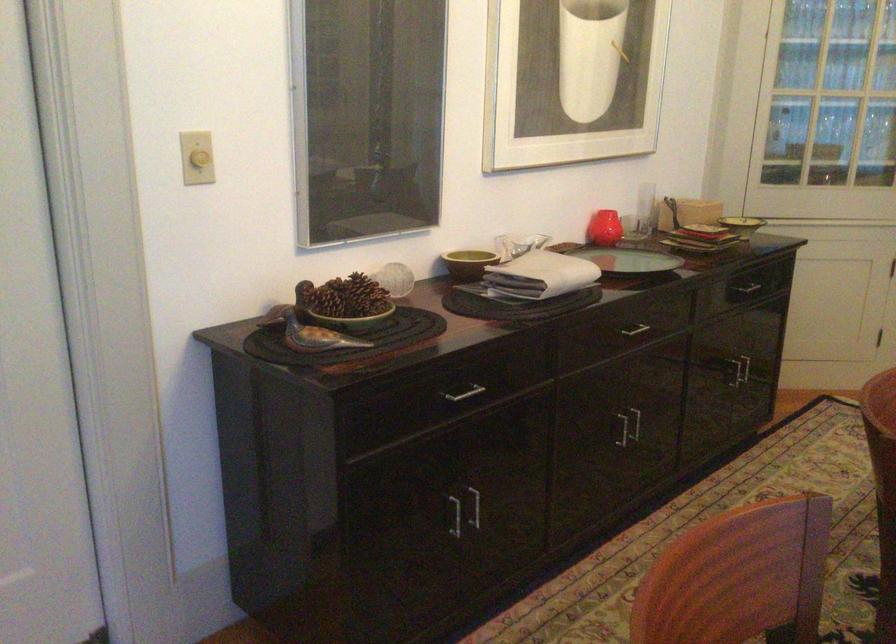
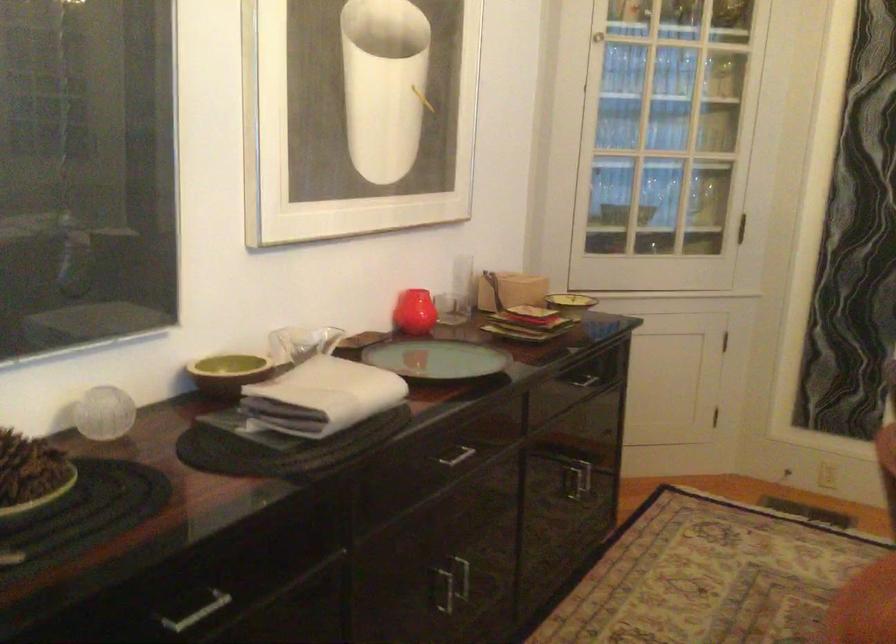
Where in the second image is the point corresponding to point (362, 297) from the first image?

(30, 475)